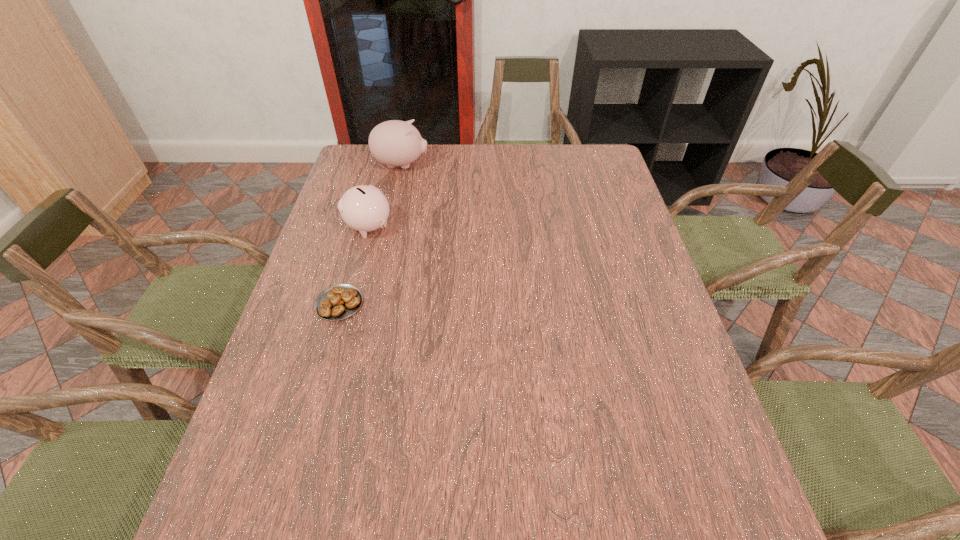
In order to click on the taller piggy bank in this screenshot , I will do `click(394, 143)`.

You are a GUI agent. You are given a task and a screenshot of the screen. Output one action in this format:
    pyautogui.click(x=<x>, y=<y>)
    Task: Click on the tallest object
    The width and height of the screenshot is (960, 540).
    Given the screenshot: What is the action you would take?
    pyautogui.click(x=394, y=143)

Locate an element on the screen. This screenshot has width=960, height=540. the second nearest object is located at coordinates (364, 208).

Locate an element on the screen. The image size is (960, 540). the second shortest object is located at coordinates (364, 208).

Where is `the shortest object`? the shortest object is located at coordinates (337, 302).

Where is `the nearest object`? This screenshot has height=540, width=960. the nearest object is located at coordinates 337,302.

The width and height of the screenshot is (960, 540). I want to click on vacant space located at the snout of the farthest object, so click(x=487, y=165).

The width and height of the screenshot is (960, 540). Identify the location of vacant space located on the front of the nearer piggy bank. (335, 348).

What are the coordinates of `free location located 0.320m on the right of the nearest object` in the screenshot? It's located at (492, 303).

Where is `object located at the far edge`? This screenshot has width=960, height=540. object located at the far edge is located at coordinates (394, 143).